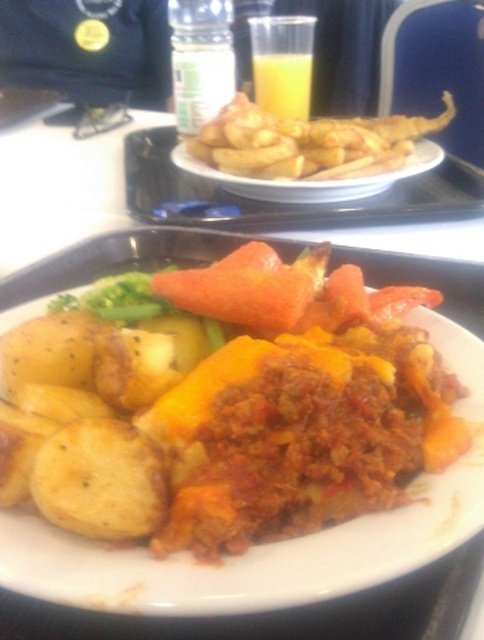
You are a customer at a restaurant and want to reach for the main dish and the side dish. The main dish is located at point (318,364) and the side dish is at point (95,499). Which dish is closer to you?

The side dish at point (95,499) is closer to you because point (318,364) is behind point (95,499).

You are a food delivery person who needs to ensure the meal is intact before delivering it. You notice two items labeled as yellow matte potatoes at lower left and yellow matte potato at lower left. Which one is actually part of the main dish and which is the side dish?

The yellow matte potatoes at lower left is the side dish, while the yellow matte potato at lower left is part of the main dish, as the description states that the potatoes in the main dish are partially submerged in sauce, which aligns with the positioning over the main dish component.